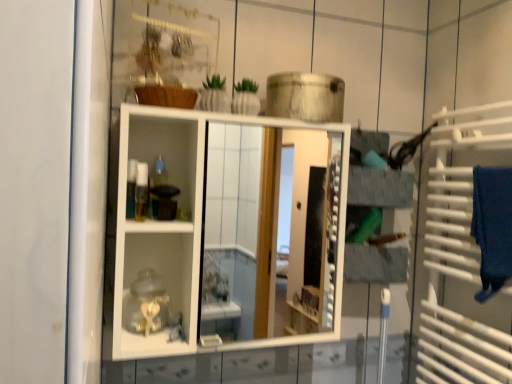
Question: From the image's perspective, is blue fabric bath towel at right under translucent plastic container at center?

Choices:
 (A) yes
 (B) no

Answer: (A)

Question: Considering the relative sizes of blue fabric bath towel at right and translucent plastic container at center in the image provided, is blue fabric bath towel at right shorter than translucent plastic container at center?

Choices:
 (A) no
 (B) yes

Answer: (A)

Question: Is blue fabric bath towel at right wider than translucent plastic container at center?

Choices:
 (A) no
 (B) yes

Answer: (B)

Question: Could you tell me if blue fabric bath towel at right is turned towards translucent plastic container at center?

Choices:
 (A) no
 (B) yes

Answer: (B)

Question: From a real-world perspective, is blue fabric bath towel at right positioned over translucent plastic container at center based on gravity?

Choices:
 (A) yes
 (B) no

Answer: (B)

Question: Does point (506, 206) appear closer or farther from the camera than point (137, 165)?

Choices:
 (A) closer
 (B) farther

Answer: (A)

Question: From the image's perspective, is blue fabric bath towel at right located above or below translucent plastic container at center?

Choices:
 (A) below
 (B) above

Answer: (A)

Question: Choose the correct answer: Is blue fabric bath towel at right inside translucent plastic container at center or outside it?

Choices:
 (A) inside
 (B) outside

Answer: (B)

Question: In terms of width, does blue fabric bath towel at right look wider or thinner when compared to translucent plastic container at center?

Choices:
 (A) thin
 (B) wide

Answer: (B)

Question: Is point (106, 291) positioned closer to the camera than point (480, 170)?

Choices:
 (A) farther
 (B) closer

Answer: (B)

Question: In terms of width, does white glossy cabinet at center look wider or thinner when compared to blue fabric bath towel at right?

Choices:
 (A) wide
 (B) thin

Answer: (A)

Question: Is white glossy cabinet at center in front of or behind blue fabric bath towel at right in the image?

Choices:
 (A) front
 (B) behind

Answer: (A)

Question: Is white glossy cabinet at center situated inside blue fabric bath towel at right or outside?

Choices:
 (A) outside
 (B) inside

Answer: (A)

Question: Considering their positions, is translucent plastic container at center located in front of or behind white metal towel rack at right?

Choices:
 (A) behind
 (B) front

Answer: (A)

Question: Visually, is translucent plastic container at center positioned to the left or to the right of white metal towel rack at right?

Choices:
 (A) right
 (B) left

Answer: (B)